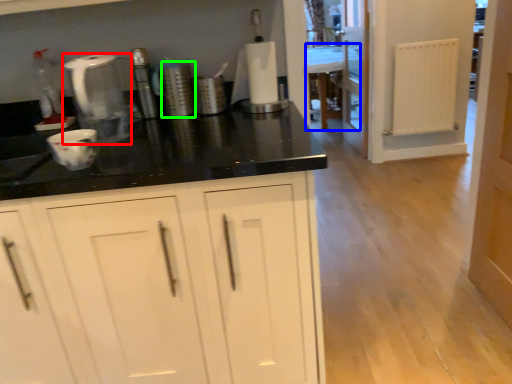
Question: Which is nearer to the home appliance (highlighted by a red box)? vanity (highlighted by a blue box) or appliance (highlighted by a green box).

Choices:
 (A) vanity
 (B) appliance

Answer: (B)